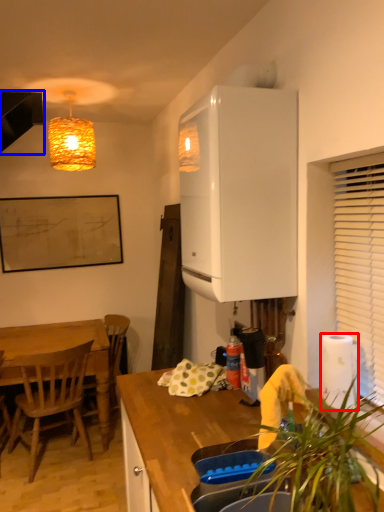
Question: Which object is closer to the camera taking this photo, paper towel (highlighted by a red box) or exhaust hood (highlighted by a blue box)?

Choices:
 (A) paper towel
 (B) exhaust hood

Answer: (A)